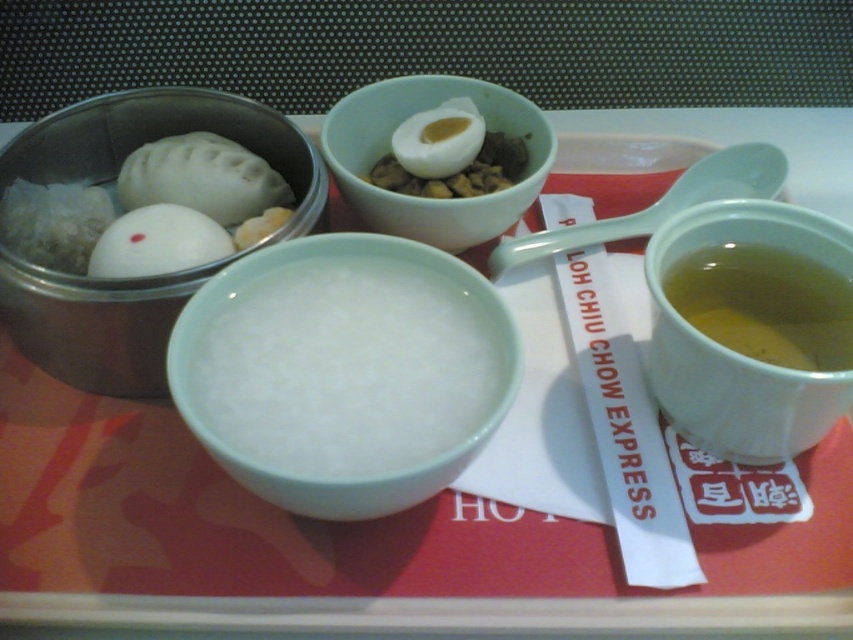
Question: Considering the relative positions of white matte rice porridge at center and translucent glass cup at upper right in the image provided, where is white matte rice porridge at center located with respect to translucent glass cup at upper right?

Choices:
 (A) below
 (B) above

Answer: (B)

Question: Which point appears farthest from the camera in this image?

Choices:
 (A) (277, 224)
 (B) (805, 280)
 (C) (646, 273)

Answer: (A)

Question: In this image, where is white matte rice porridge at center located relative to matte ceramic bowl at center?

Choices:
 (A) right
 (B) left

Answer: (B)

Question: Is translucent glass cup at upper right below matte white egg at center?

Choices:
 (A) no
 (B) yes

Answer: (B)

Question: Which point is closer to the camera?

Choices:
 (A) matte ceramic bowl at center
 (B) white matte egg at center-left
 (C) translucent glass cup at upper right

Answer: (C)

Question: Which point is closer to the camera taking this photo?

Choices:
 (A) (666, 406)
 (B) (332, 120)
 (C) (55, 362)
 (D) (225, 250)

Answer: (A)